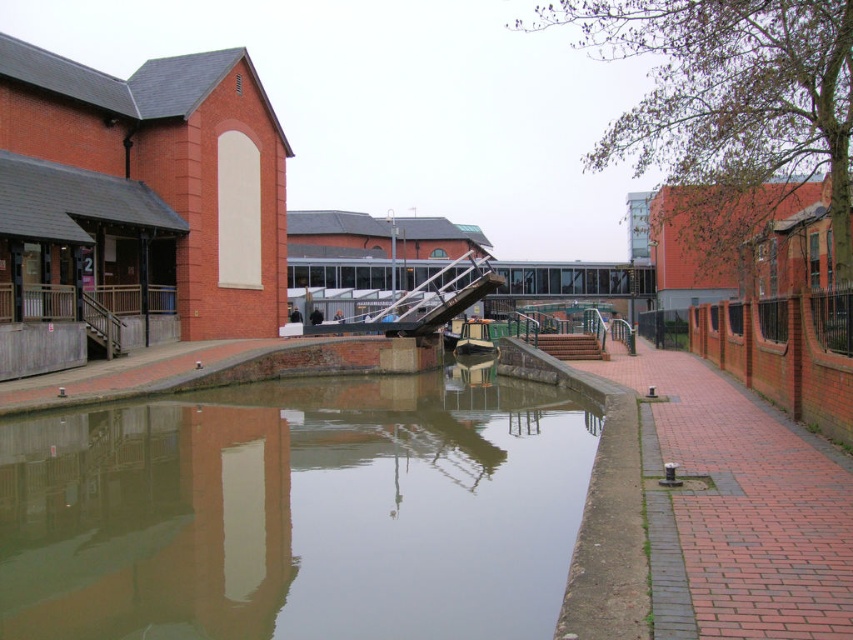
Question: Which point is closer to the camera?

Choices:
 (A) smooth concrete water at center
 (B) wooden boat at center

Answer: (A)

Question: Is smooth concrete water at center behind wooden boat at center?

Choices:
 (A) yes
 (B) no

Answer: (B)

Question: Among these objects, which one is farthest from the camera?

Choices:
 (A) smooth concrete water at center
 (B) wooden boat at center

Answer: (B)

Question: Is smooth concrete water at center wider than wooden boat at center?

Choices:
 (A) yes
 (B) no

Answer: (A)

Question: Is smooth concrete water at center positioned before wooden boat at center?

Choices:
 (A) yes
 (B) no

Answer: (A)